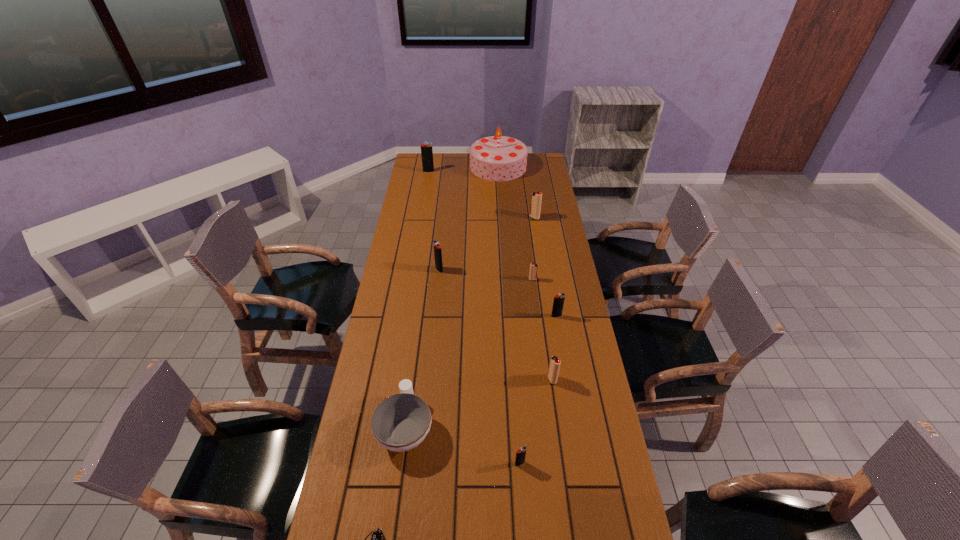
This screenshot has width=960, height=540. I want to click on chinaware that is at the left edge, so click(401, 422).

Image resolution: width=960 pixels, height=540 pixels. Identify the location of birthday cake at the right edge. (495, 158).

Locate an element on the screen. The width and height of the screenshot is (960, 540). object that is at the far left corner is located at coordinates (426, 149).

Identify the location of object that is at the far right corner. The height and width of the screenshot is (540, 960). (495, 158).

Image resolution: width=960 pixels, height=540 pixels. Identify the location of vacant area at the far edge. (454, 161).

Identify the location of vacant space at the left edge of the desktop. (434, 180).

Locate an element on the screen. This screenshot has height=540, width=960. vacant space at the right edge of the desktop is located at coordinates (527, 178).

Identify the location of empty location between the tallest igniter and the white chinaware. This screenshot has height=540, width=960. (417, 300).

Where is `empty space between the sixth farthest igniter and the farthest igniter`? empty space between the sixth farthest igniter and the farthest igniter is located at coordinates coord(491,275).

The height and width of the screenshot is (540, 960). I want to click on free space between the white chinaware and the second black igniter from right to left, so click(463, 446).